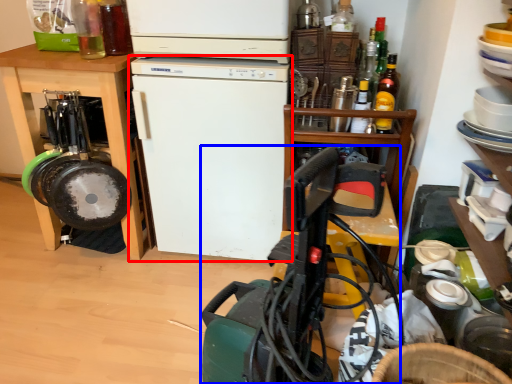
Question: Which object appears closest to the camera in this image, refrigerator (highlighted by a red box) or appliance (highlighted by a blue box)?

Choices:
 (A) refrigerator
 (B) appliance

Answer: (B)